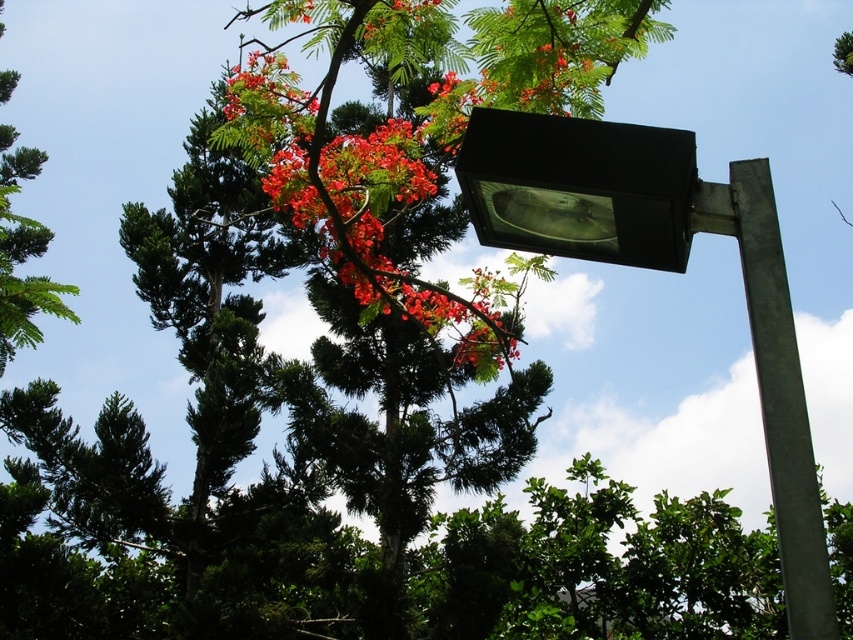
You are a bird flying over the scene and want to land on the highest point between the shiny red petals at upper center and the black plastic lamp at upper right. Which one should you choose?

The shiny red petals at upper center is much taller than the black plastic lamp at upper right, so you should choose the shiny red petals at upper center to land on the highest point.

You are an urban planner assessing the visibility of the black plastic lamp at upper right and the green leafy tree at upper left. Which object takes up more space in the image?

The green leafy tree at upper left takes up more space in the image than the black plastic lamp at upper right.

You are a bird flying over the scene and want to land on either the black plastic lamp at upper right or the green leafy tree at upper left. Which one is closer to you as you approach from above?

The black plastic lamp at upper right is closer to the viewer than the green leafy tree at upper left, so the bird should land on the black plastic lamp at upper right as it is nearer.